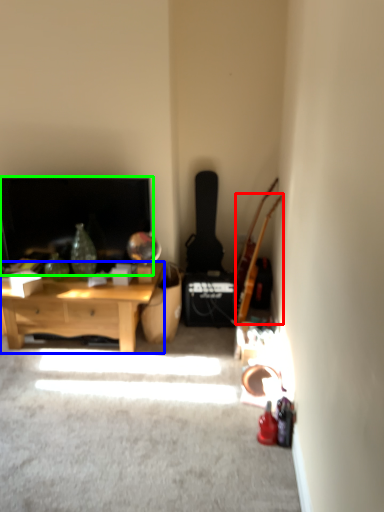
Question: Which object is the closest to the guitar (highlighted by a red box)? Choose among these: desk (highlighted by a blue box) or fireplace (highlighted by a green box).

Choices:
 (A) desk
 (B) fireplace

Answer: (A)